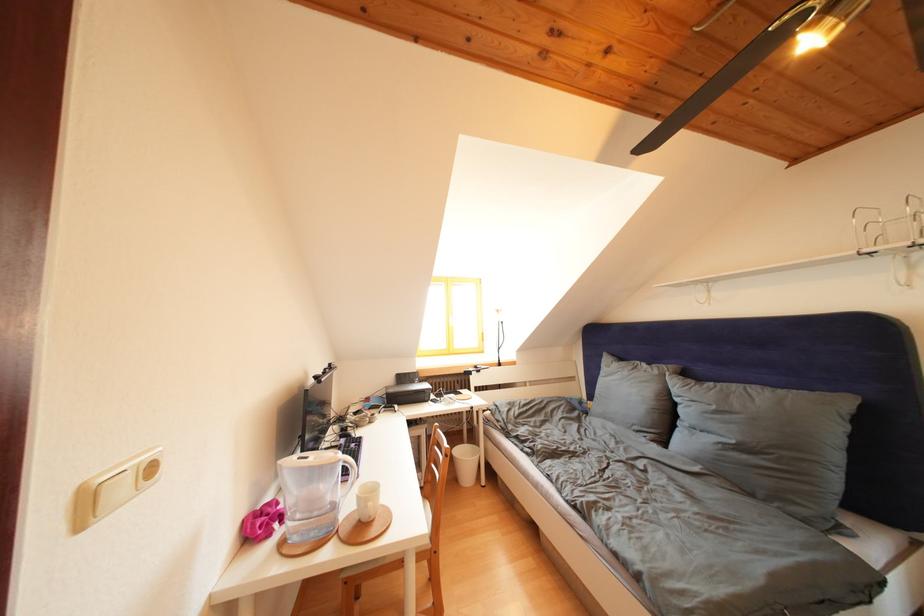
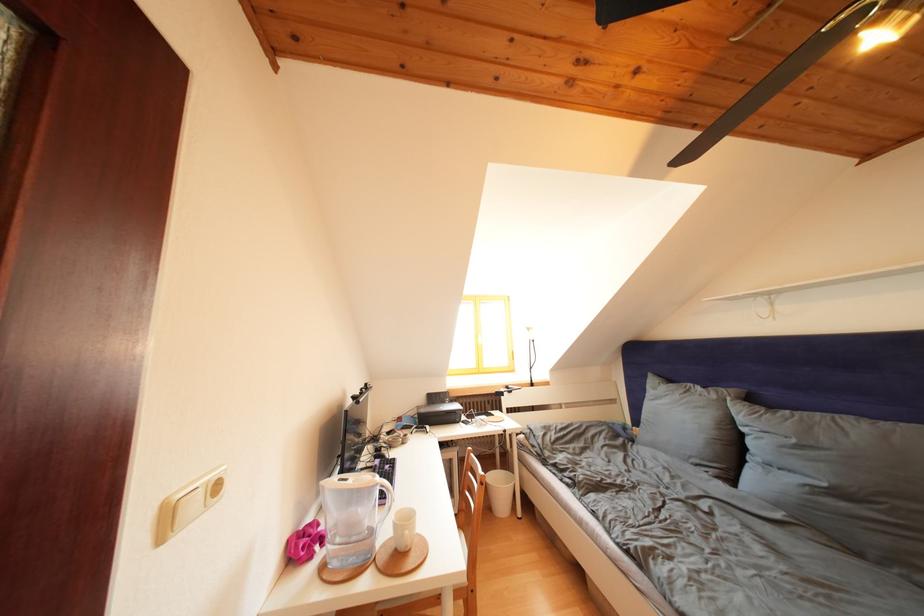
Find the pixel in the second image that matches (469,447) in the first image.

(503, 472)